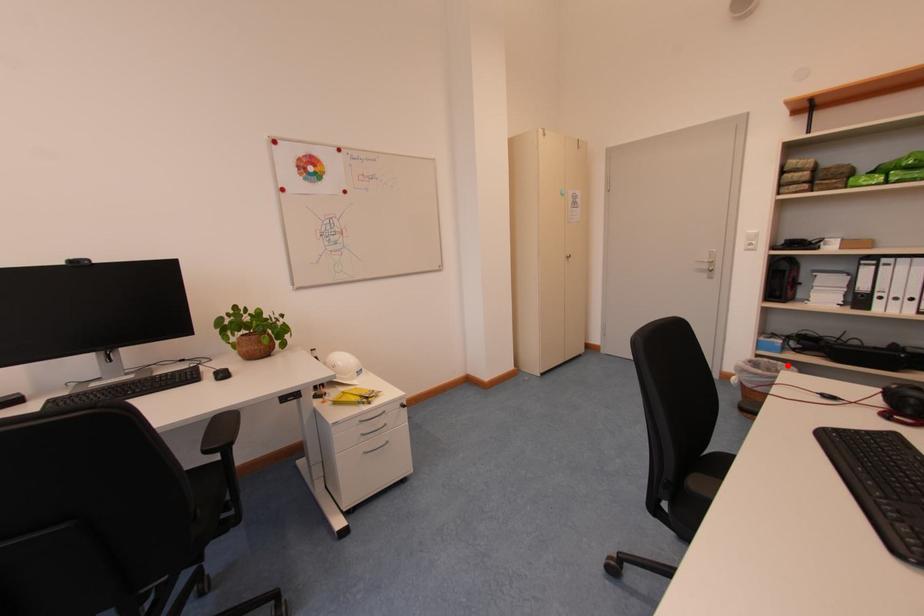
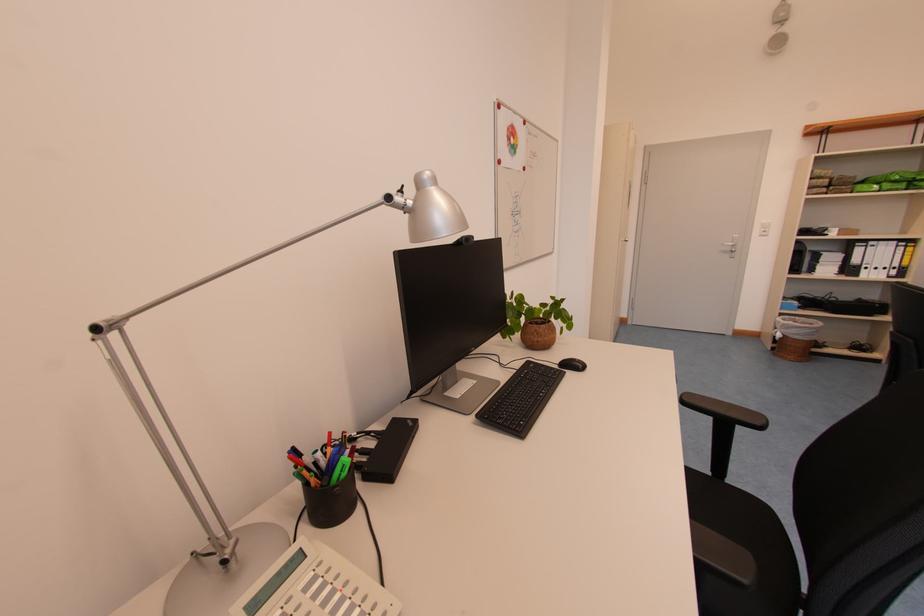
Find the pixel in the second image that matches the highlighted location in the first image.

(805, 321)